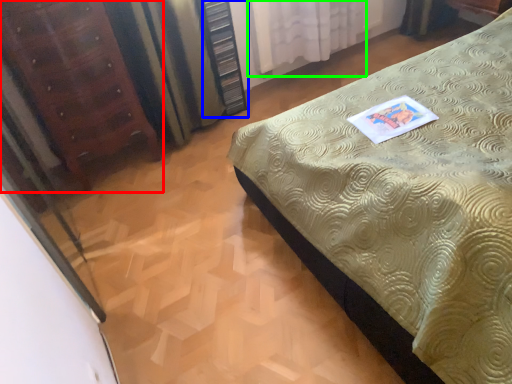
Question: Estimate the real-world distances between objects in this image. Which object is farther from furniture (highlighted by a red box), dresser (highlighted by a blue box) or curtain (highlighted by a green box)?

Choices:
 (A) dresser
 (B) curtain

Answer: (B)